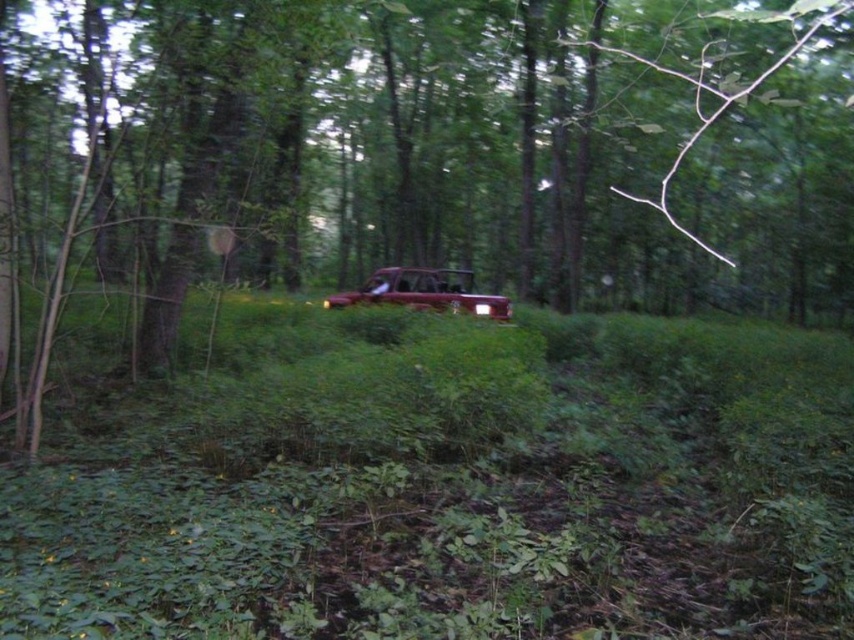
Question: Can you confirm if green matte tree at center is wider than shiny maroon car at center?

Choices:
 (A) yes
 (B) no

Answer: (A)

Question: Among these points, which one is nearest to the camera?

Choices:
 (A) (341, 298)
 (B) (273, 218)

Answer: (B)

Question: Is green matte tree at center to the right of shiny maroon car at center from the viewer's perspective?

Choices:
 (A) yes
 (B) no

Answer: (B)

Question: Can you confirm if green matte tree at center is positioned below shiny maroon car at center?

Choices:
 (A) yes
 (B) no

Answer: (B)

Question: Among these objects, which one is farthest from the camera?

Choices:
 (A) shiny maroon car at center
 (B) green matte tree at center

Answer: (A)